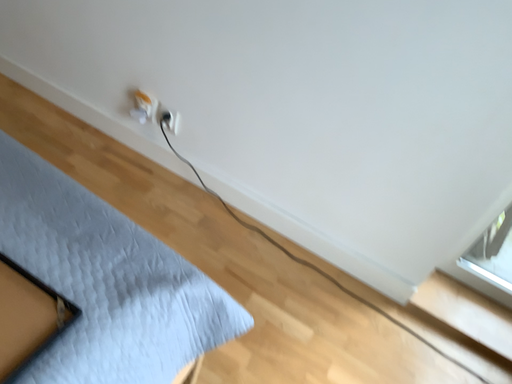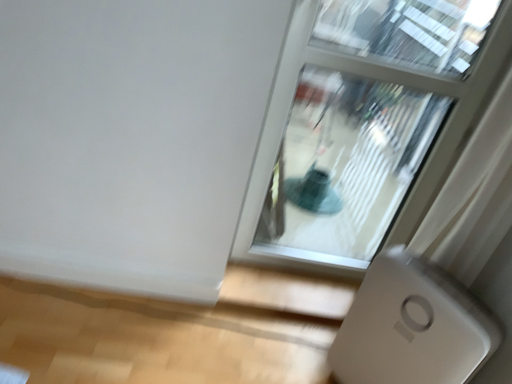
Question: Which way did the camera rotate in the video?

Choices:
 (A) rotated downward
 (B) rotated upward

Answer: (B)